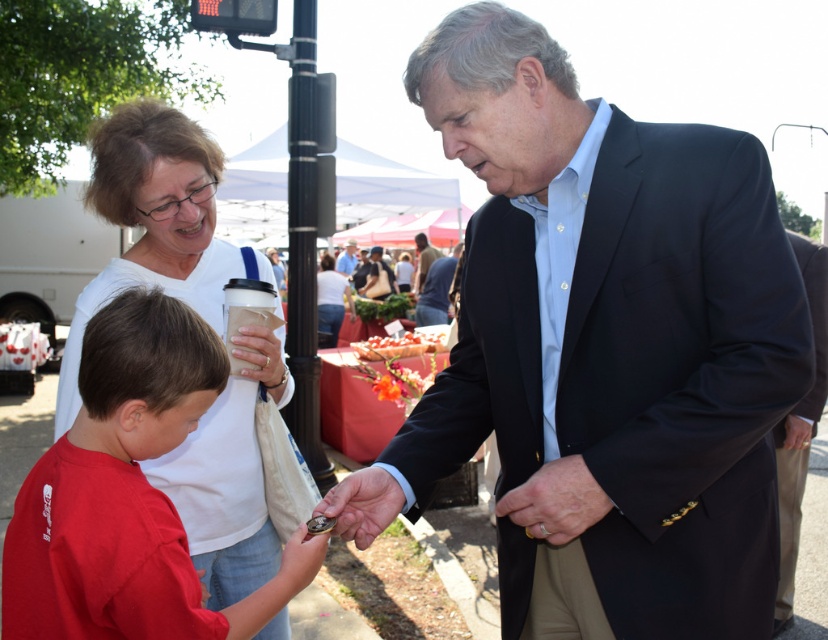
Is point (345, 518) less distant than point (354, 252)?

Yes, it is in front of point (354, 252).

Can you confirm if smooth leather hand at center is positioned to the right of light blue shirt at center?

Yes, smooth leather hand at center is to the right of light blue shirt at center.

Does point (369, 534) come behind point (349, 248)?

No, (369, 534) is in front of (349, 248).

Where is `smooth leather hand at center`? This screenshot has width=828, height=640. smooth leather hand at center is located at coordinates (362, 504).

Does white matte shirt at upper left appear under dark suit jacket at center?

Indeed, white matte shirt at upper left is positioned under dark suit jacket at center.

Is white matte shirt at upper left taller than dark suit jacket at center?

Yes.

Is point (179, 136) more distant than point (426, 246)?

No, it is not.

Where is `white matte shirt at upper left`? The width and height of the screenshot is (828, 640). white matte shirt at upper left is located at coordinates (155, 221).

Can you confirm if matte black suit at center is positioned to the right of light blue shirt at center?

Yes, matte black suit at center is to the right of light blue shirt at center.

Does matte black suit at center have a smaller size compared to light blue shirt at center?

Yes.

The width and height of the screenshot is (828, 640). Describe the element at coordinates (609, 346) in the screenshot. I see `matte black suit at center` at that location.

You are a GUI agent. You are given a task and a screenshot of the screen. Output one action in this format:
    pyautogui.click(x=<x>, y=<y>)
    Task: Click on the matte black suit at center
    
    Given the screenshot: What is the action you would take?
    pyautogui.click(x=609, y=346)